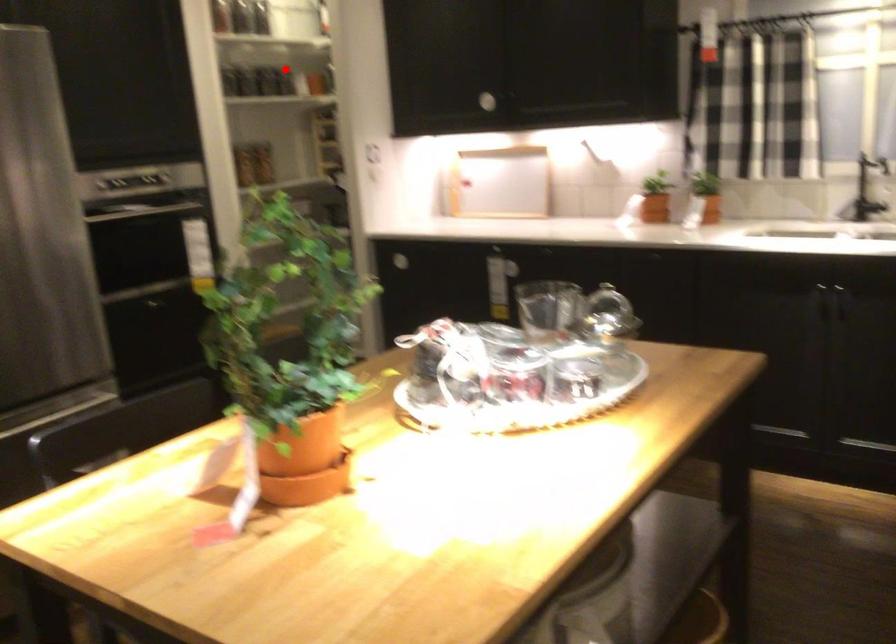
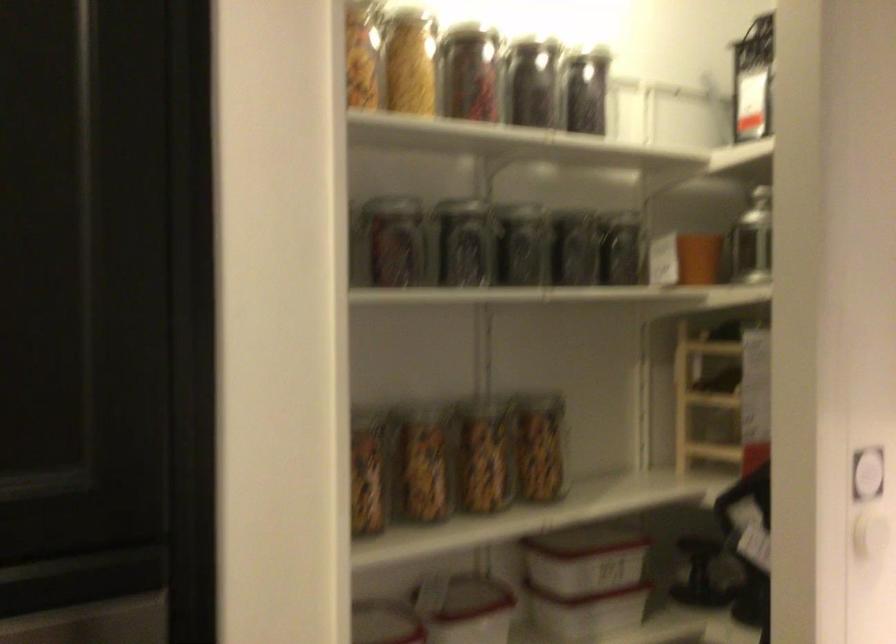
Question: I am providing you with two images of the same scene from different viewpoints. In image1, a red point is highlighted. Considering the same 3D point in image2, which of the following is correct?

Choices:
 (A) It is closer
 (B) It is farther

Answer: (A)